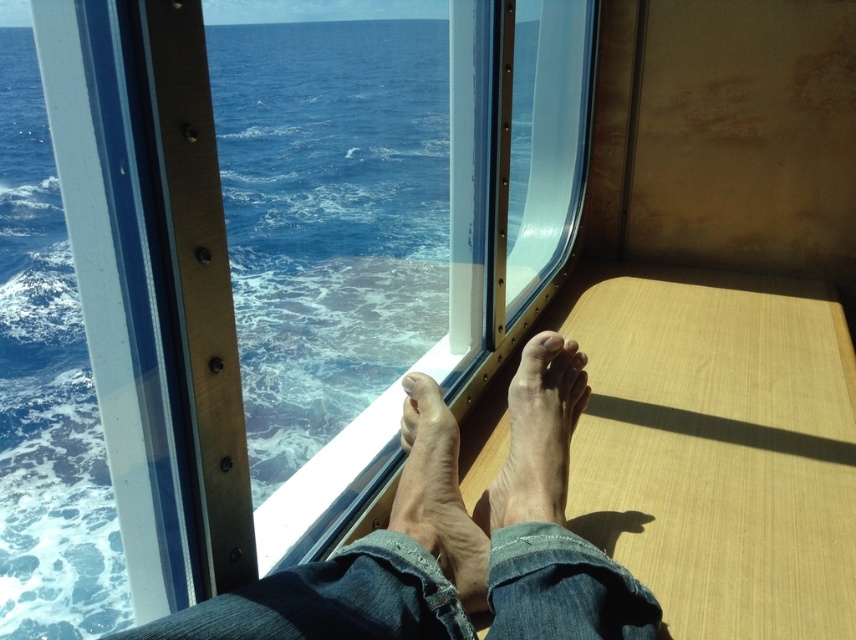
You are a photographer taking a closeup shot of the feet on the wooden bench. You need to ensure both the smooth skin feet at center and the matte skin toe at center are in focus. Since depth of field is limited, which part should you focus on to ensure the larger object remains sharp?

You should focus on the smooth skin feet at center because it has a larger size compared to the matte skin toe at center, so prioritizing the larger object ensures it stays sharp within the limited depth of field.

You are a photographer taking a picture of the dry skin foot at lower center and the pale skin toe at center from the cabin window. Which part of the foot is closer to the ocean view?

The dry skin foot at lower center is located below the pale skin toe at center, so the pale skin toe at center is closer to the ocean view as it is positioned above the dry skin foot.

You are a photographer taking a portrait of the person sitting on the wooden bench. You notice two objects in the scene that are both at the center. One is labeled as smooth skin feet at center and the other is smooth skin foot at center. Which of these two objects is taller?

The smooth skin feet at center is much taller than the smooth skin foot at center.